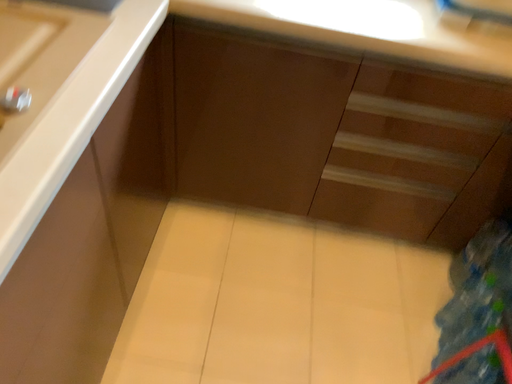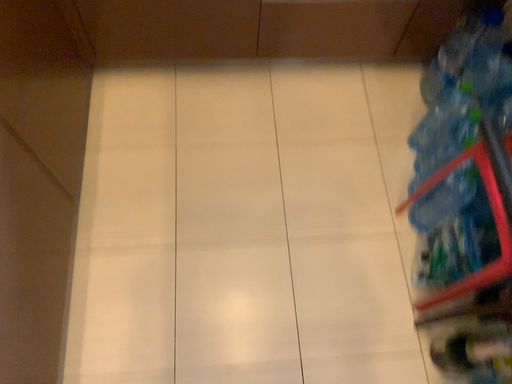
Question: Which way did the camera rotate in the video?

Choices:
 (A) rotated upward
 (B) rotated downward

Answer: (B)